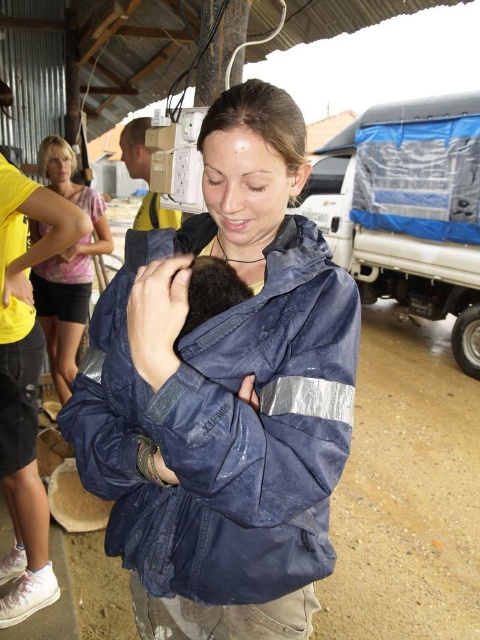
Question: From the image, what is the correct spatial relationship of navy blue jacket at center in relation to matte pink shirt at upper left?

Choices:
 (A) above
 (B) below

Answer: (B)

Question: Which point is farther from the camera taking this photo?

Choices:
 (A) (29, 225)
 (B) (73, 394)

Answer: (A)

Question: Does navy blue jacket at center have a smaller size compared to matte pink shirt at upper left?

Choices:
 (A) yes
 (B) no

Answer: (A)

Question: In this image, where is navy blue jacket at center located relative to matte pink shirt at upper left?

Choices:
 (A) right
 (B) left

Answer: (A)

Question: Which object is farther from the camera taking this photo?

Choices:
 (A) navy blue jacket at center
 (B) matte pink shirt at upper left

Answer: (B)